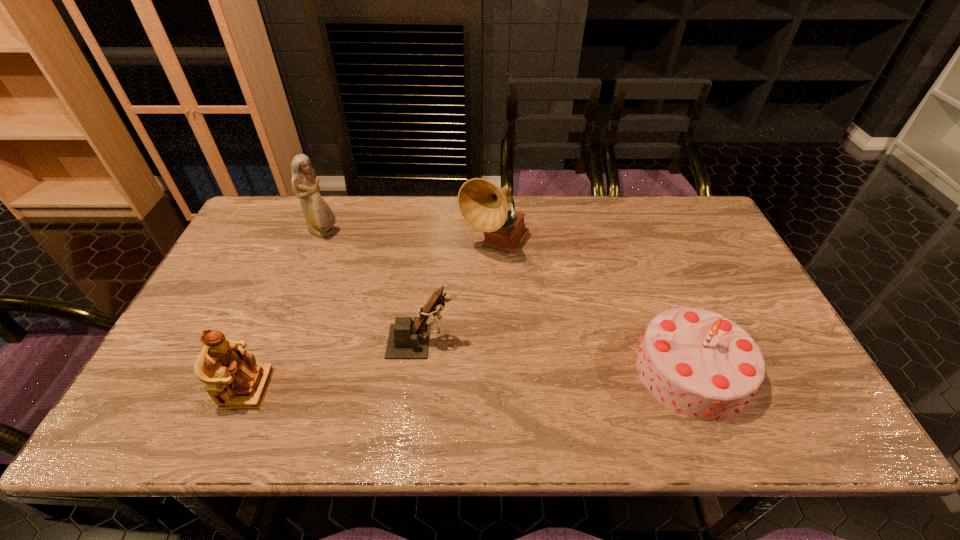
This screenshot has width=960, height=540. Identify the location of the farthest figurine. (319, 217).

The width and height of the screenshot is (960, 540). In order to click on phonograph record in this screenshot , I will do `click(482, 204)`.

The width and height of the screenshot is (960, 540). I want to click on the rightmost figurine, so [408, 339].

Find the location of `the nearest figurine`. the nearest figurine is located at coordinates (233, 379).

Locate an element on the screen. the rightmost object is located at coordinates (698, 363).

Locate an element on the screen. The width and height of the screenshot is (960, 540). vacant space located on the front-facing side of the tallest figurine is located at coordinates (407, 233).

At what (x,y) coordinates should I click in order to perform the action: click on free space located on the horn of the phonograph record. Please return your answer as a coordinate pair (x, y). The image size is (960, 540). Looking at the image, I should click on (496, 282).

Image resolution: width=960 pixels, height=540 pixels. In order to click on vacant point located on the front-facing side of the rightmost figurine in this screenshot , I will do `click(542, 342)`.

Where is `free point located on the front-facing side of the nearest figurine`? free point located on the front-facing side of the nearest figurine is located at coordinates (415, 388).

Image resolution: width=960 pixels, height=540 pixels. Find the location of `blank space located on the left of the rightmost object`. blank space located on the left of the rightmost object is located at coordinates (532, 371).